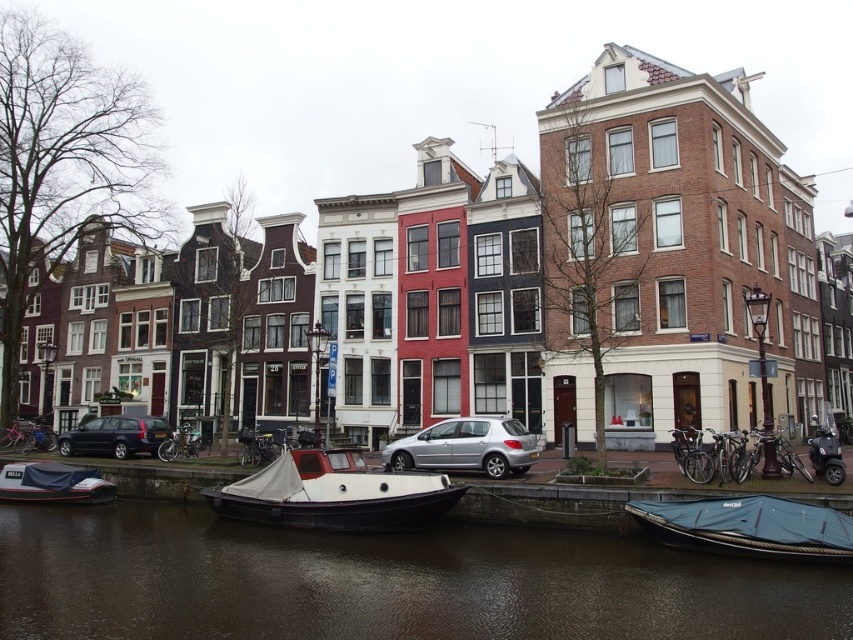
Question: Can you confirm if teal canvas boat at lower right is wider than silver metallic car at center?

Choices:
 (A) yes
 (B) no

Answer: (B)

Question: Which point appears farthest from the camera in this image?

Choices:
 (A) (x=670, y=532)
 (B) (x=67, y=492)
 (C) (x=502, y=620)

Answer: (B)

Question: Which of the following is the closest to the observer?

Choices:
 (A) (233, 513)
 (B) (74, 492)
 (C) (444, 456)
 (D) (408, 557)

Answer: (D)

Question: Does teal canvas boat at lower right have a smaller size compared to silver metallic car at center?

Choices:
 (A) yes
 (B) no

Answer: (A)

Question: Is white matte boat at lower left thinner than matte black station wagon at lower left?

Choices:
 (A) no
 (B) yes

Answer: (B)

Question: Which of the following is the closest to the observer?

Choices:
 (A) (518, 435)
 (B) (688, 515)
 (C) (546, 627)
 (D) (138, 419)

Answer: (C)